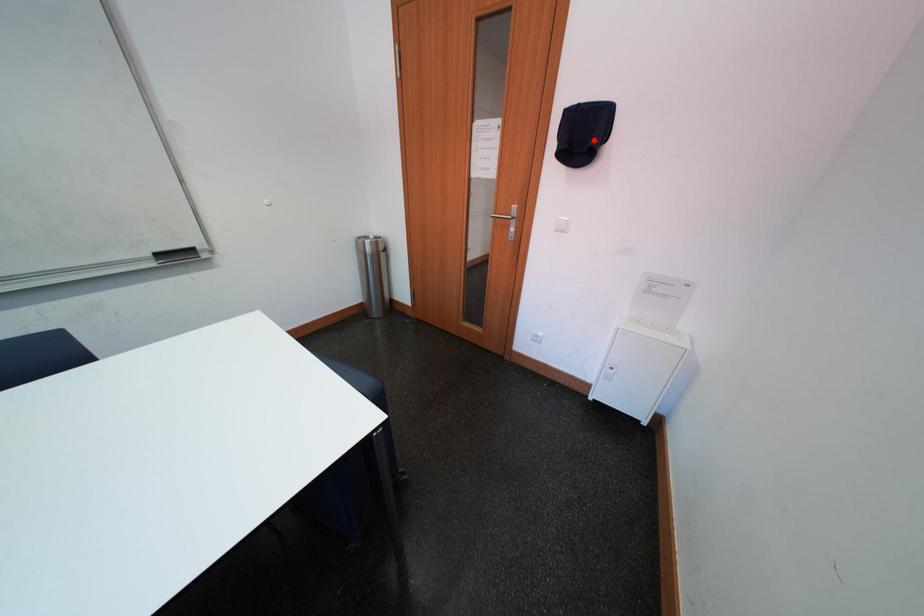
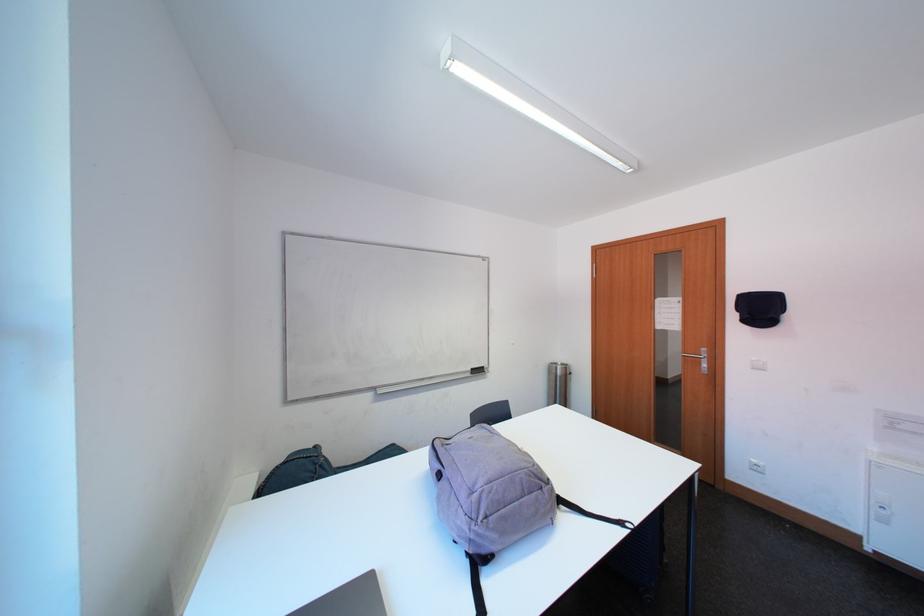
The point at the highlighted location is marked in the first image. Where is the corresponding point in the second image?

(771, 313)